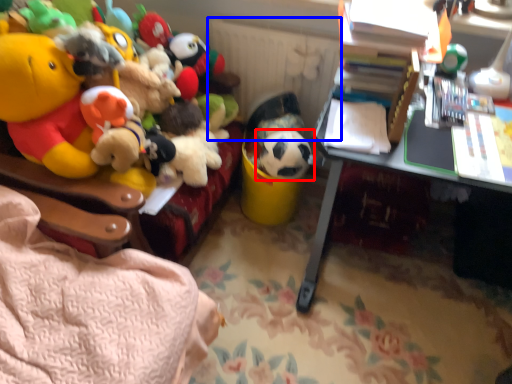
Question: Which object appears closest to the camera in this image, toy (highlighted by a red box) or radiator (highlighted by a blue box)?

Choices:
 (A) toy
 (B) radiator

Answer: (A)